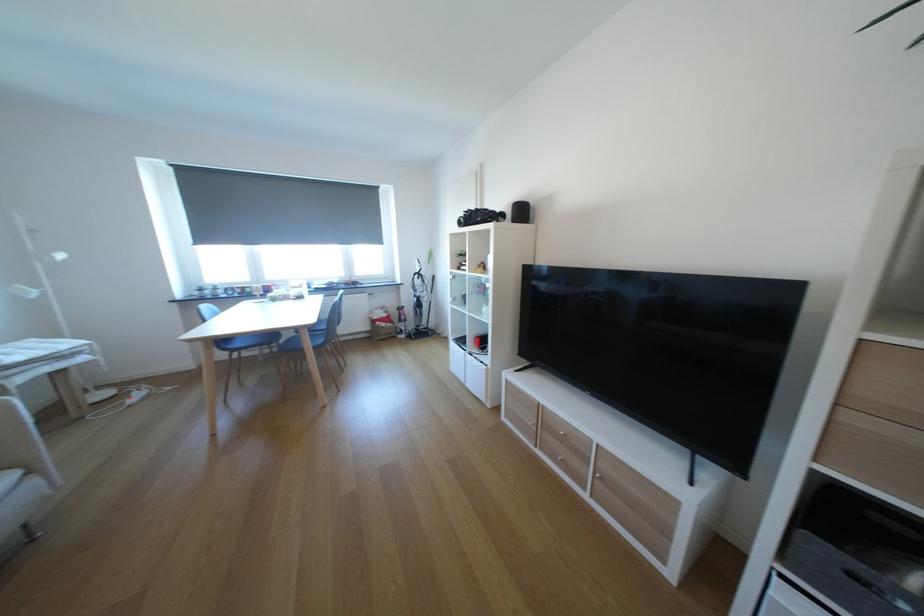
The height and width of the screenshot is (616, 924). Describe the element at coordinates (8, 480) in the screenshot. I see `a sofa sitting surface` at that location.